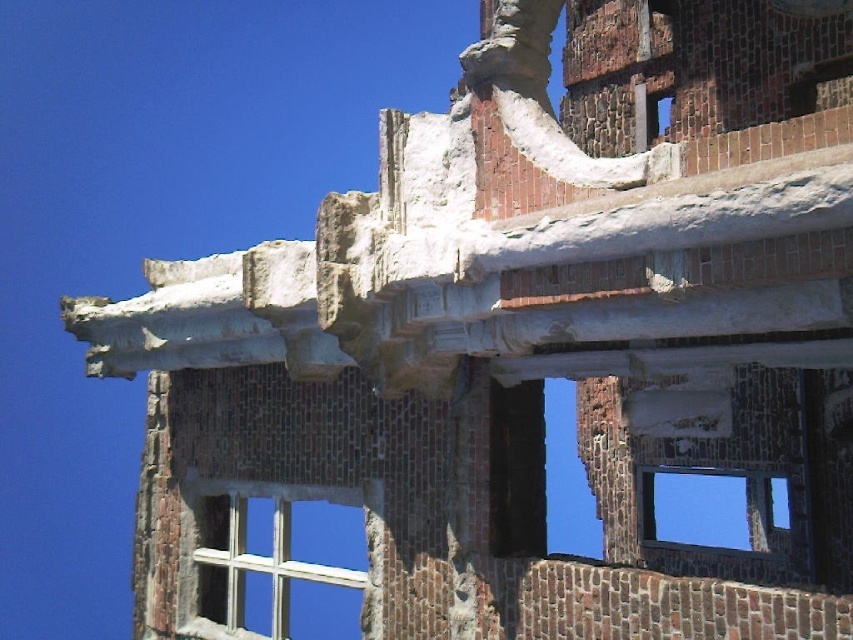
You are an architect inspecting the building. You notice two windows at the center of the structure. Which one is higher up, the white wooden window at center or the transparent glass window at center?

The white wooden window at center is positioned over the transparent glass window at center, so the white wooden window at center is higher up.